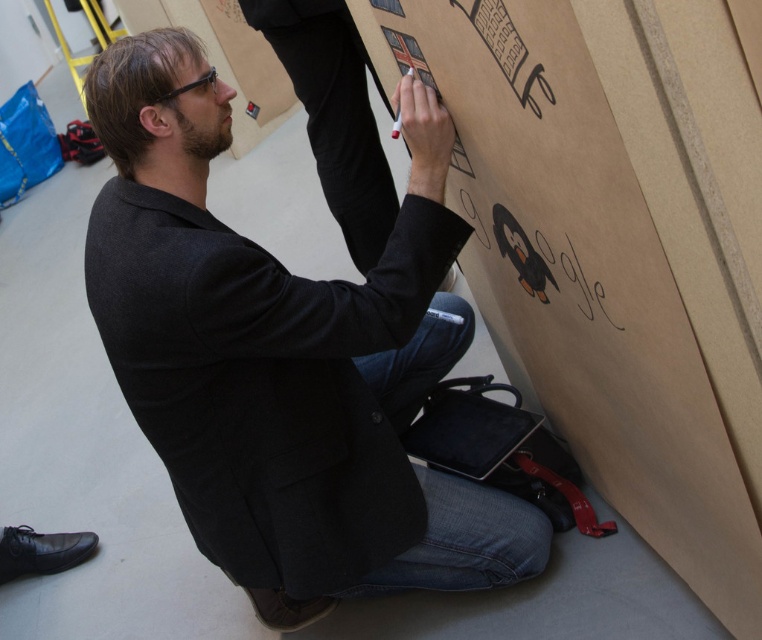
Is point (728, 253) farther from viewer compared to point (216, 112)?

No, (728, 253) is closer to viewer.

Who is lower down, brown cardboard at center or dark gray woolen blazer at center?

Positioned lower is dark gray woolen blazer at center.

Which is in front, point (692, 163) or point (452, 225)?

Point (692, 163)

This screenshot has height=640, width=762. Find the location of `brown cardboard at center`. brown cardboard at center is located at coordinates (615, 246).